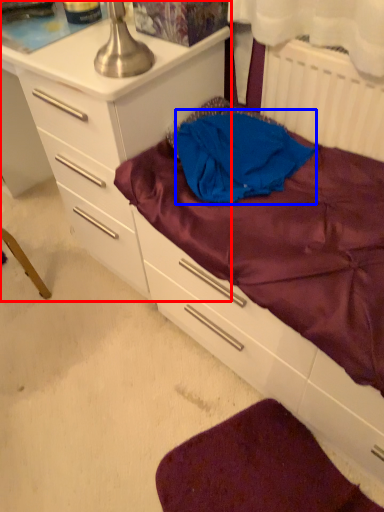
Question: Which point is closer to the camera, chest of drawers (highlighted by a red box) or clothing (highlighted by a blue box)?

Choices:
 (A) chest of drawers
 (B) clothing

Answer: (A)